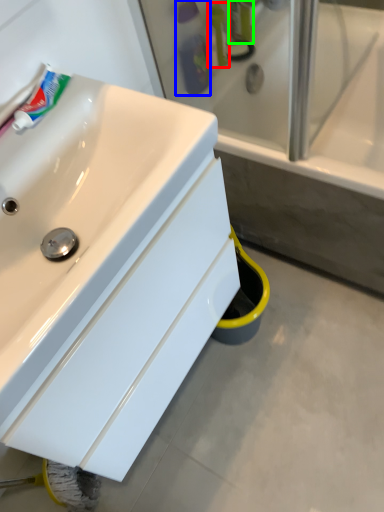
Question: Considering the real-world distances, which object is farthest from mouthwash (highlighted by a red box)? toiletry (highlighted by a blue box) or toiletry (highlighted by a green box)?

Choices:
 (A) toiletry
 (B) toiletry

Answer: (B)